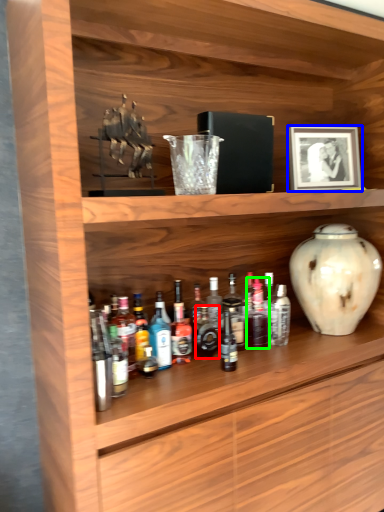
Question: Which is nearer to the bottle (highlighted by a red box)? picture frame (highlighted by a blue box) or bottle (highlighted by a green box).

Choices:
 (A) picture frame
 (B) bottle

Answer: (B)